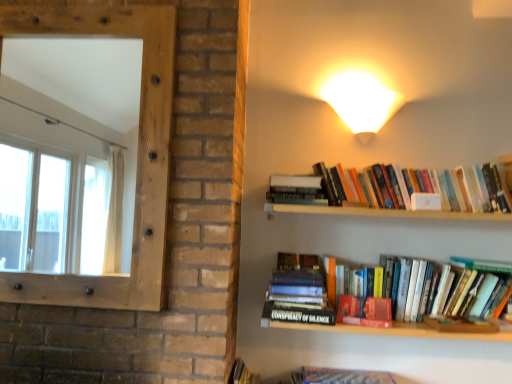
Question: From the image's perspective, is white glossy wall sconce at upper right above or below hardcover books at upper right, arranged as the 1th book when viewed from the top?

Choices:
 (A) above
 (B) below

Answer: (A)

Question: In terms of height, does white glossy wall sconce at upper right look taller or shorter compared to hardcover books at upper right, which ranks as the second book in bottom-to-top order?

Choices:
 (A) tall
 (B) short

Answer: (A)

Question: Based on their relative distances, which object is nearer to the hardcover books at upper right, which appears as the first book when viewed from the right?

Choices:
 (A) natural wood frame at left
 (B) matte red paperback book at center
 (C) white glossy wall sconce at upper right
 (D) hardcover book at center, the 1th book viewed from the left

Answer: (C)

Question: Considering the real-world distances, which object is farthest from the natural wood frame at left?

Choices:
 (A) hardcover book at center, placed as the first book when sorted from bottom to top
 (B) white glossy wall sconce at upper right
 (C) matte red paperback book at center
 (D) hardcover books at upper right, which ranks as the second book in bottom-to-top order

Answer: (C)